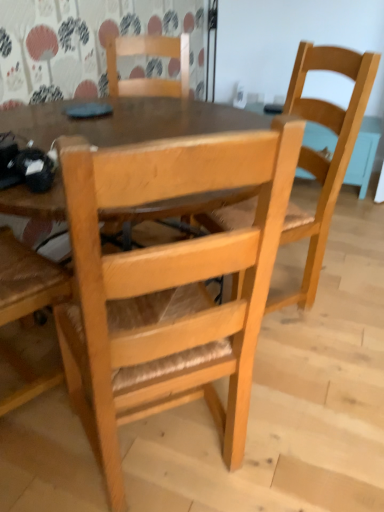
Question: Based on their positions, is natural wood chair at center, arranged as the first chair when viewed from the back, located to the left or right of natural wood chair at right, the 2th chair when ordered from front to back?

Choices:
 (A) left
 (B) right

Answer: (A)

Question: Is natural wood chair at center, the 3th chair from the front, in front of or behind natural wood chair at right, the second chair viewed from the back, in the image?

Choices:
 (A) front
 (B) behind

Answer: (B)

Question: Considering the real-world distances, which object is farthest from the natural wood chair at center, the 3th chair from the front?

Choices:
 (A) natural wood chair at right, the 2th chair when ordered from front to back
 (B) natural wood chair at center, the first chair positioned from the front

Answer: (B)

Question: Based on their relative distances, which object is farther from the natural wood chair at center, the first chair positioned from the front?

Choices:
 (A) natural wood chair at center, the 3th chair from the front
 (B) natural wood chair at right, the 2th chair when ordered from front to back

Answer: (A)